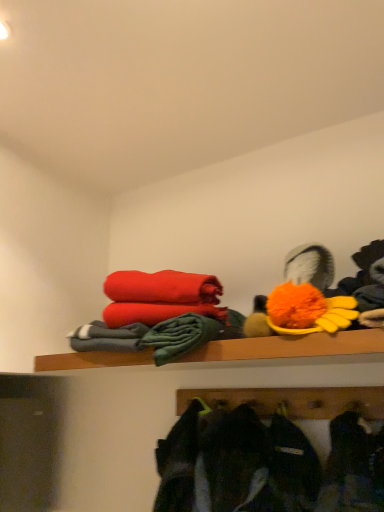
Question: Can you confirm if wooden shelf at upper center is thinner than fluffy orange pom-pom at upper right?

Choices:
 (A) no
 (B) yes

Answer: (A)

Question: Is wooden shelf at upper center at the right side of fluffy orange pom-pom at upper right?

Choices:
 (A) no
 (B) yes

Answer: (A)

Question: Would you say wooden shelf at upper center contains fluffy orange pom-pom at upper right?

Choices:
 (A) no
 (B) yes

Answer: (A)

Question: Considering the relative positions of wooden shelf at upper center and fluffy orange pom-pom at upper right in the image provided, is wooden shelf at upper center behind fluffy orange pom-pom at upper right?

Choices:
 (A) no
 (B) yes

Answer: (A)

Question: From a real-world perspective, is wooden shelf at upper center physically below fluffy orange pom-pom at upper right?

Choices:
 (A) yes
 (B) no

Answer: (A)

Question: Does wooden shelf at upper center have a greater height compared to fluffy orange pom-pom at upper right?

Choices:
 (A) yes
 (B) no

Answer: (B)

Question: Are fluffy orange pom-pom at upper right and dark gray fabric jacket at lower center making contact?

Choices:
 (A) yes
 (B) no

Answer: (B)

Question: Is fluffy orange pom-pom at upper right shorter than dark gray fabric jacket at lower center?

Choices:
 (A) yes
 (B) no

Answer: (A)

Question: Would you say dark gray fabric jacket at lower center is part of fluffy orange pom-pom at upper right's contents?

Choices:
 (A) no
 (B) yes

Answer: (A)

Question: Is fluffy orange pom-pom at upper right positioned behind dark gray fabric jacket at lower center?

Choices:
 (A) no
 (B) yes

Answer: (B)

Question: Would you consider fluffy orange pom-pom at upper right to be distant from dark gray fabric jacket at lower center?

Choices:
 (A) yes
 (B) no

Answer: (B)

Question: Does fluffy orange pom-pom at upper right have a greater width compared to dark gray fabric jacket at lower center?

Choices:
 (A) yes
 (B) no

Answer: (B)

Question: Is wooden shelf at upper center at the right side of dark gray fabric jacket at lower center?

Choices:
 (A) no
 (B) yes

Answer: (A)